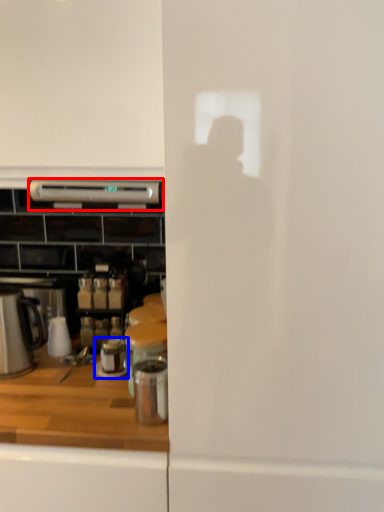
Question: Among these objects, which one is farthest to the camera, kitchen appliance (highlighted by a red box) or appliance (highlighted by a blue box)?

Choices:
 (A) kitchen appliance
 (B) appliance

Answer: (B)